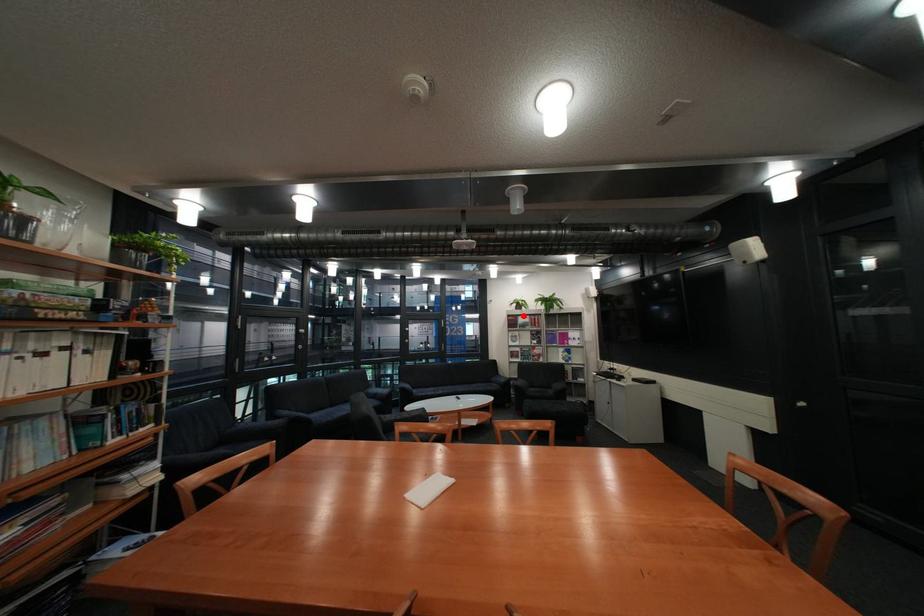
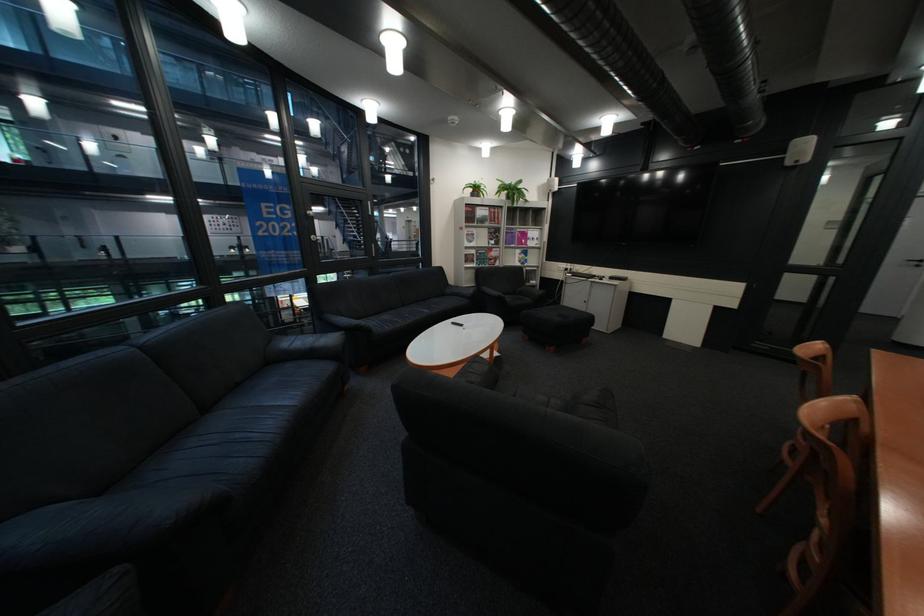
The point at the highlighted location is marked in the first image. Where is the corresponding point in the second image?

(481, 205)